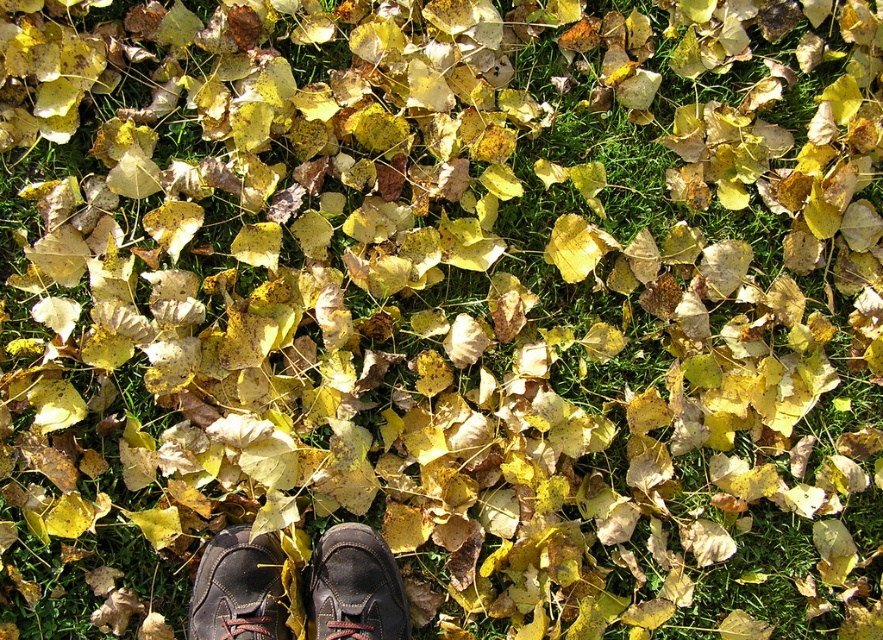
Question: Is black leather shoes at center positioned before matte black shoe at center?

Choices:
 (A) no
 (B) yes

Answer: (B)

Question: Which of the following is the closest to the observer?

Choices:
 (A) (230, 536)
 (B) (386, 564)

Answer: (A)

Question: Is black leather shoes at center to the right of matte black shoe at center from the viewer's perspective?

Choices:
 (A) yes
 (B) no

Answer: (B)

Question: Where is matte black shoe at center located in relation to dark brown leather shoe at center in the image?

Choices:
 (A) left
 (B) right

Answer: (B)

Question: Which object is positioned farthest from the black leather shoes at center?

Choices:
 (A) matte black shoe at center
 (B) dark brown leather shoe at center

Answer: (B)

Question: Considering the real-world distances, which object is farthest from the matte black shoe at center?

Choices:
 (A) dark brown leather shoe at center
 (B) black leather shoes at center

Answer: (A)